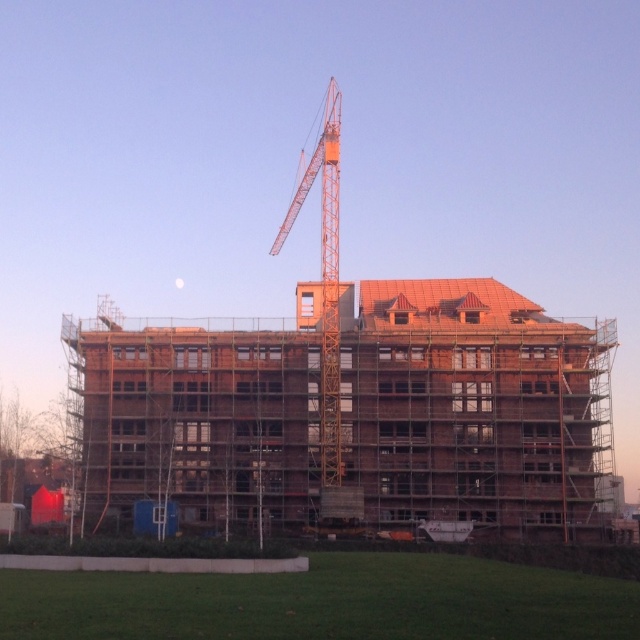
Looking at this image, is brown wooden building at center below orange metallic crane at center?

Correct, brown wooden building at center is located below orange metallic crane at center.

Identify the location of brown wooden building at center. (472, 406).

Does point (545, 412) come in front of point (332, 316)?

Yes, it is.

The image size is (640, 640). I want to click on brown wooden building at center, so click(x=472, y=406).